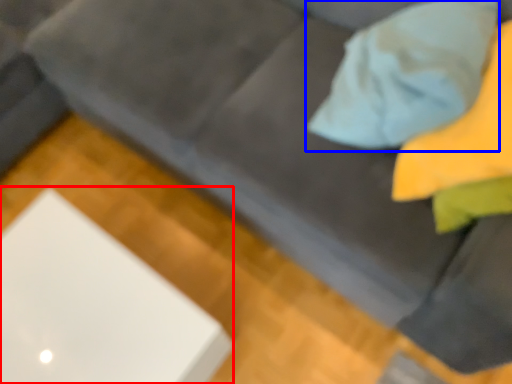
Question: Which object is closer to the camera taking this photo, computer (highlighted by a red box) or throw pillow (highlighted by a blue box)?

Choices:
 (A) computer
 (B) throw pillow

Answer: (B)